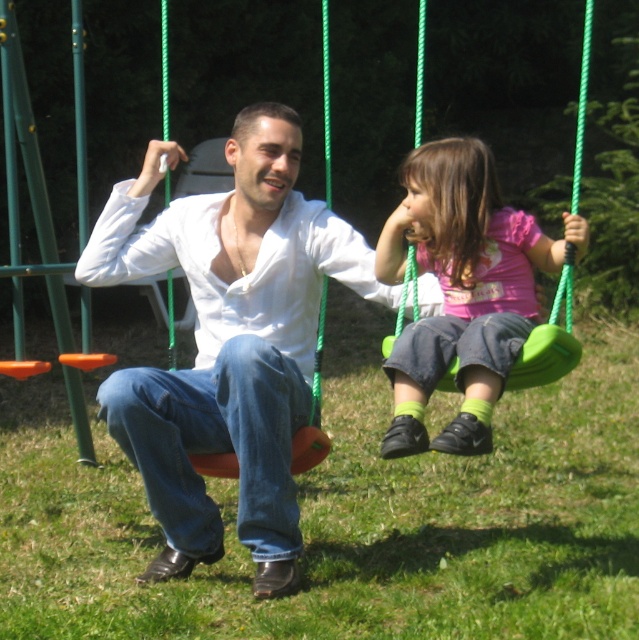
Does white matte shirt at center have a lesser height compared to matte orange swing at left?

Correct, white matte shirt at center is not as tall as matte orange swing at left.

Between white matte shirt at center and matte orange swing at left, which one is positioned lower?

white matte shirt at center

Image resolution: width=639 pixels, height=640 pixels. Describe the element at coordinates (227, 340) in the screenshot. I see `white matte shirt at center` at that location.

Identify the location of white matte shirt at center. This screenshot has width=639, height=640. (227, 340).

Is white matte shirt at center taller than pink matte shirt at center?

Yes.

Does point (173, 566) come farther from viewer compared to point (521, 218)?

That is True.

At what (x,y) coordinates should I click in order to perform the action: click on white matte shirt at center. Please return your answer as a coordinate pair (x, y). Image resolution: width=639 pixels, height=640 pixels. Looking at the image, I should click on (227, 340).

Does pink matte shirt at center have a greater height compared to matte orange swing at left?

No.

Who is higher up, pink matte shirt at center or matte orange swing at left?

matte orange swing at left

This screenshot has height=640, width=639. What are the coordinates of `pink matte shirt at center` in the screenshot? It's located at (463, 289).